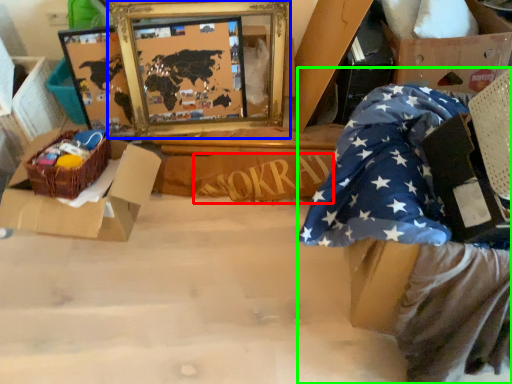
Question: Which object is the farthest from writing (highlighted by a red box)? Choose among these: picture frame (highlighted by a blue box) or person (highlighted by a green box).

Choices:
 (A) picture frame
 (B) person

Answer: (B)